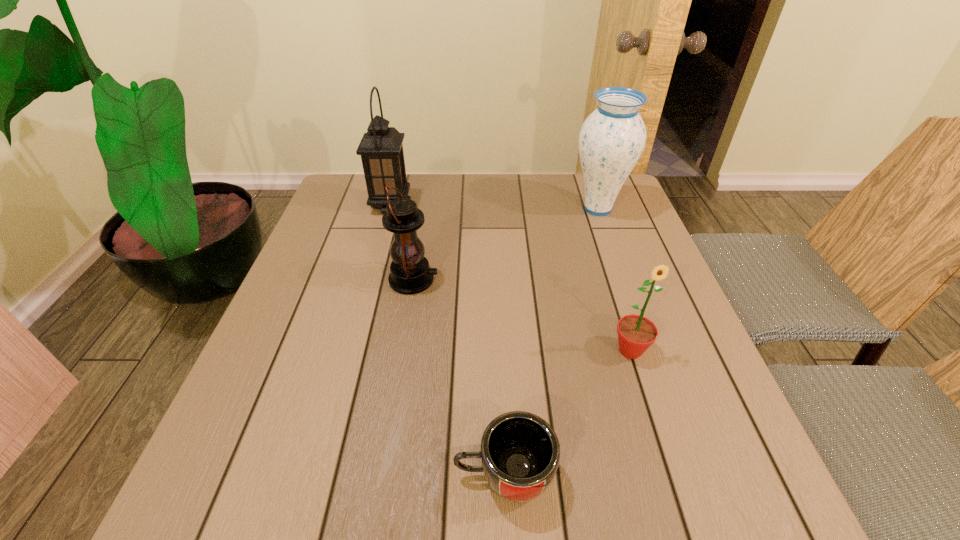
At what (x,y) coordinates should I click in order to perform the action: click on unoccupied area between the sunflower and the nearest object. Please return your answer as a coordinate pair (x, y). The height and width of the screenshot is (540, 960). Looking at the image, I should click on (567, 413).

This screenshot has width=960, height=540. Find the location of `blank region between the nearer lantern and the vase`. blank region between the nearer lantern and the vase is located at coordinates (506, 245).

You are a GUI agent. You are given a task and a screenshot of the screen. Output one action in this format:
    pyautogui.click(x=<x>, y=<y>)
    Task: Click on the empty location between the sunflower and the third object from right to left
    
    Given the screenshot: What is the action you would take?
    pyautogui.click(x=567, y=413)

Locate an element on the screen. This screenshot has height=540, width=960. free space between the nearest object and the taller lantern is located at coordinates (447, 340).

Locate an element on the screen. The height and width of the screenshot is (540, 960). free space between the shorter lantern and the nearest object is located at coordinates [459, 377].

Where is `free point between the third farthest object and the mug`? The width and height of the screenshot is (960, 540). free point between the third farthest object and the mug is located at coordinates (459, 377).

Image resolution: width=960 pixels, height=540 pixels. Identify the location of object that is the closest to the farther lantern. (410, 273).

Identify which object is the fourth nearest to the taller lantern. Please provide its 2D coordinates. Your answer should be formatted as a tuple, i.e. [(x, y)], where the tuple contains the x and y coordinates of a point satisfying the conditions above.

[(520, 452)]

You are a GUI agent. You are given a task and a screenshot of the screen. Output one action in this format:
    pyautogui.click(x=<x>, y=<y>)
    Task: Click on the vacant space that satisfies the following two spatial constraints: 1. on the front side of the vase; 2. above the third nearest object, indicating its light source
    
    Given the screenshot: What is the action you would take?
    pyautogui.click(x=623, y=280)

Locate an element on the screen. The image size is (960, 540). free space in the image that satisfies the following two spatial constraints: 1. on the face of the sunflower; 2. on the side of the shortest object with the handle is located at coordinates (670, 475).